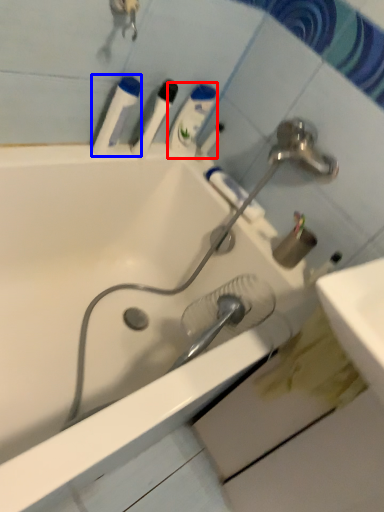
Question: Which of the following is the farthest to the observer, mouthwash (highlighted by a red box) or mouthwash (highlighted by a blue box)?

Choices:
 (A) mouthwash
 (B) mouthwash

Answer: (A)